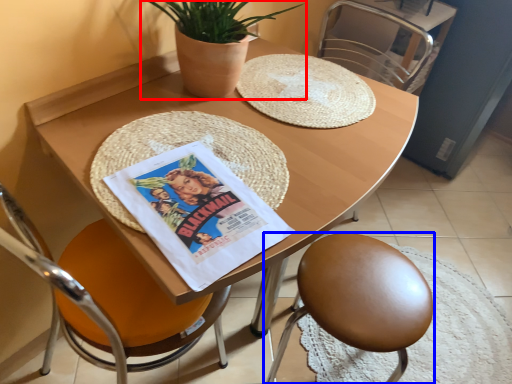
Question: Which object is closer to the camera taking this photo, houseplant (highlighted by a red box) or chair (highlighted by a blue box)?

Choices:
 (A) houseplant
 (B) chair

Answer: (A)